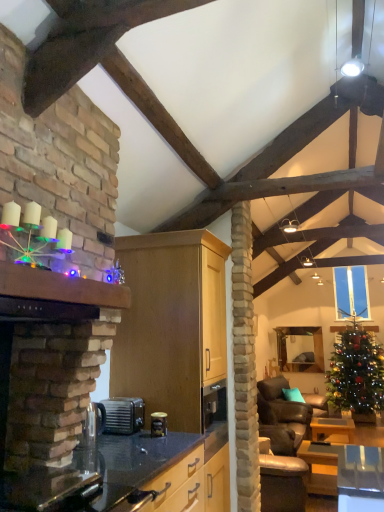
Question: Should I look upward or downward to see wooden table at lower right, which ranks as the 1th table in back-to-front order?

Choices:
 (A) down
 (B) up

Answer: (A)

Question: Can you confirm if clear glass window at upper center is smaller than wooden table at lower right, the second table when ordered from back to front?

Choices:
 (A) no
 (B) yes

Answer: (B)

Question: Is clear glass window at upper center to the left of wooden table at lower right, which ranks as the first table in front-to-back order, from the viewer's perspective?

Choices:
 (A) no
 (B) yes

Answer: (A)

Question: Is clear glass window at upper center to the right of wooden table at lower right, the second table when ordered from back to front, from the viewer's perspective?

Choices:
 (A) no
 (B) yes

Answer: (B)

Question: From a real-world perspective, is clear glass window at upper center located higher than wooden table at lower right, which ranks as the first table in front-to-back order?

Choices:
 (A) no
 (B) yes

Answer: (B)

Question: Would you say clear glass window at upper center contains wooden table at lower right, which ranks as the first table in front-to-back order?

Choices:
 (A) no
 (B) yes

Answer: (A)

Question: Is clear glass window at upper center not within wooden table at lower right, which ranks as the first table in front-to-back order?

Choices:
 (A) no
 (B) yes

Answer: (B)

Question: Considering the relative positions of wooden mantle at upper left and wooden table at lower right, the second table when ordered from back to front, in the image provided, is wooden mantle at upper left to the left of wooden table at lower right, the second table when ordered from back to front, from the viewer's perspective?

Choices:
 (A) no
 (B) yes

Answer: (B)

Question: Is wooden mantle at upper left behind wooden table at lower right, the second table when ordered from back to front?

Choices:
 (A) yes
 (B) no

Answer: (B)

Question: Considering the relative sizes of wooden mantle at upper left and wooden table at lower right, which ranks as the first table in front-to-back order, in the image provided, is wooden mantle at upper left bigger than wooden table at lower right, which ranks as the first table in front-to-back order,?

Choices:
 (A) yes
 (B) no

Answer: (B)

Question: Is the depth of wooden mantle at upper left less than that of wooden table at lower right, which ranks as the first table in front-to-back order?

Choices:
 (A) no
 (B) yes

Answer: (B)

Question: Can you confirm if wooden mantle at upper left is taller than wooden table at lower right, the second table when ordered from back to front?

Choices:
 (A) no
 (B) yes

Answer: (A)

Question: Is wooden mantle at upper left not within wooden table at lower right, which ranks as the first table in front-to-back order?

Choices:
 (A) yes
 (B) no

Answer: (A)

Question: From the image's perspective, would you say wooden mantle at upper left is positioned over clear glass carafe at lower left, which is the first appliance from front to back?

Choices:
 (A) yes
 (B) no

Answer: (A)